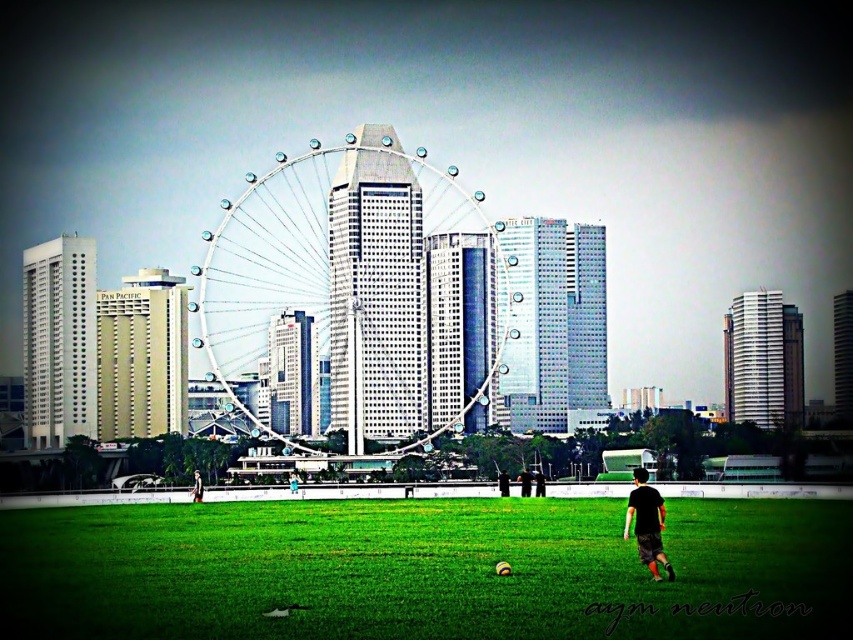
Question: Is green grass field at lower center above black matte shirt at lower right?

Choices:
 (A) no
 (B) yes

Answer: (A)

Question: Which of the following is the farthest from the observer?

Choices:
 (A) black matte shirt at lower right
 (B) metallic silver ferris wheel at center

Answer: (A)

Question: Which object is farther from the camera taking this photo?

Choices:
 (A) green grass field at lower center
 (B) black matte shirt at lower right
 (C) black fabric shirt at lower center
 (D) metallic silver ferris wheel at center

Answer: (C)

Question: Can you confirm if green grass field at lower center is smaller than black fabric shirt at lower center?

Choices:
 (A) yes
 (B) no

Answer: (B)

Question: Does green grass field at lower center appear on the left side of metallic silver ferris wheel at center?

Choices:
 (A) yes
 (B) no

Answer: (B)

Question: Estimate the real-world distances between objects in this image. Which object is closer to the black matte shirt at lower right?

Choices:
 (A) green grass field at lower center
 (B) metallic silver ferris wheel at center
 (C) black fabric shirt at lower center

Answer: (A)